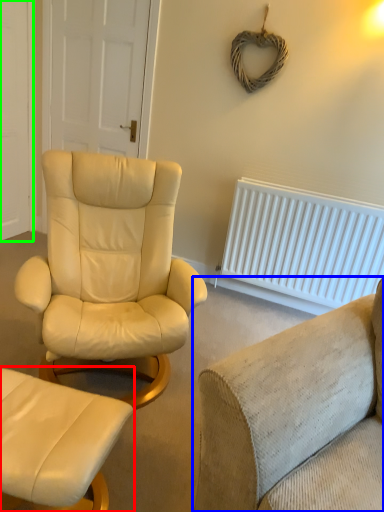
Question: Estimate the real-world distances between objects in this image. Which object is closer to chair (highlighted by a red box), studio couch (highlighted by a blue box) or door (highlighted by a green box)?

Choices:
 (A) studio couch
 (B) door

Answer: (A)